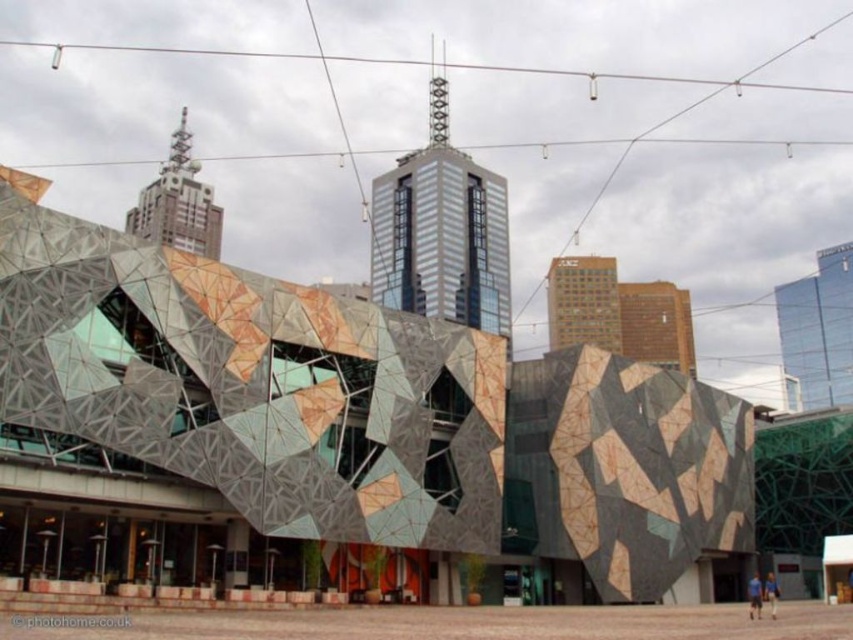
Can you confirm if glassy reflective skyscraper at upper right is bigger than metallic glass skyscraper at upper center?

No.

At what (x,y) coordinates should I click in order to perform the action: click on glassy reflective skyscraper at upper right. Please return your answer as a coordinate pair (x, y). Looking at the image, I should click on (817, 330).

Which is more to the right, glassy steel skyscraper at center or glassy reflective skyscraper at upper right?

glassy reflective skyscraper at upper right

Who is taller, glassy steel skyscraper at center or glassy reflective skyscraper at upper right?

glassy steel skyscraper at center is taller.

Does point (483, 188) come farther from viewer compared to point (817, 301)?

Yes, it is behind point (817, 301).

Locate an element on the screen. This screenshot has height=640, width=853. glassy steel skyscraper at center is located at coordinates (442, 240).

Is point (410, 236) positioned in front of point (190, 243)?

That is True.

Identify the location of glassy steel skyscraper at center. (442, 240).